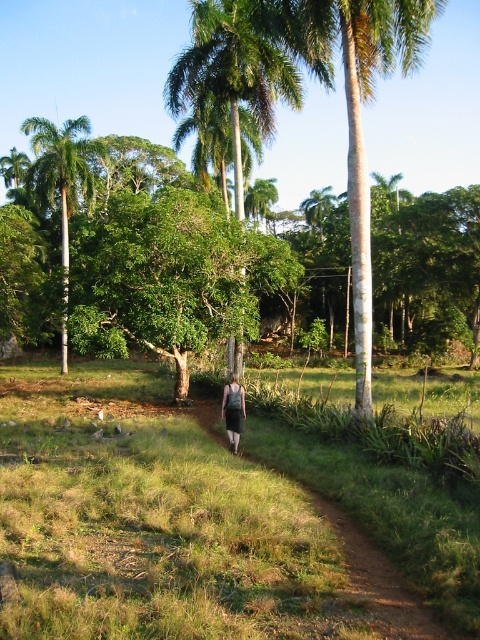
Between green leafy palm tree at left and gray fabric skirt at center, which one appears on the left side from the viewer's perspective?

green leafy palm tree at left is more to the left.

The height and width of the screenshot is (640, 480). Describe the element at coordinates (60, 184) in the screenshot. I see `green leafy palm tree at left` at that location.

Identify the location of green leafy palm tree at left. (60, 184).

Who is more distant from viewer, (195, 3) or (230, 387)?

Point (195, 3)

Describe the element at coordinates (230, 81) in the screenshot. I see `green leafy palm tree at center` at that location.

Is point (265, 40) less distant than point (238, 390)?

No, (265, 40) is further to viewer.

This screenshot has height=640, width=480. Find the location of `green leafy palm tree at center`. green leafy palm tree at center is located at coordinates (230, 81).

Measure the distance between green grass at center and gray fabric skirt at center.

green grass at center is 3.43 meters away from gray fabric skirt at center.

Is green grass at center thinner than gray fabric skirt at center?

No.

Which is behind, point (171, 572) or point (228, 410)?

Positioned behind is point (228, 410).

Locate an element on the screen. This screenshot has width=480, height=640. green grass at center is located at coordinates (152, 522).